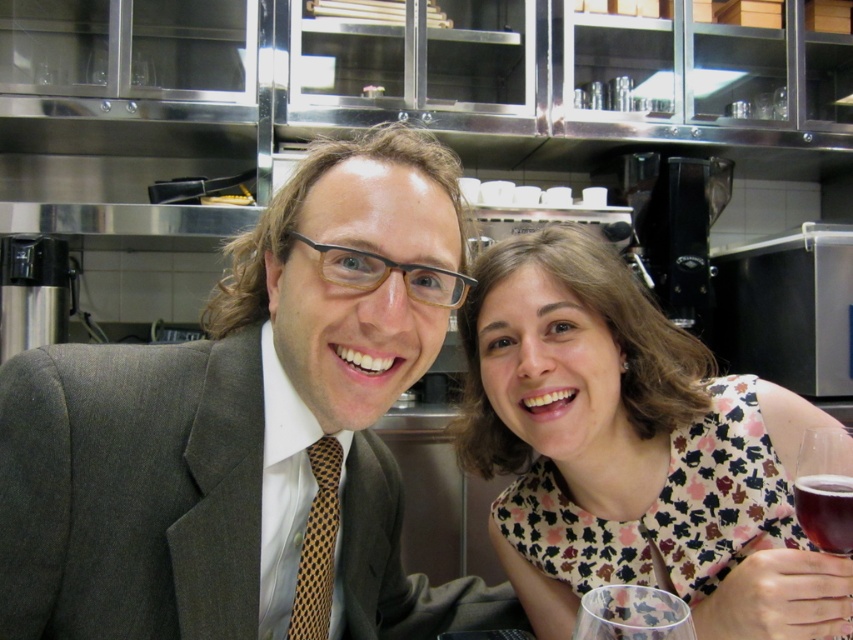
You are a photographer setting up for a group photo. You need to ensure that the matte gray suit at center and the transparent plastic wine glass at lower right are both in frame. Considering their sizes, which object will require more space in the photo to capture its full width?

The matte gray suit at center requires more space in the photo because its width is larger than the transparent plastic wine glass at lower right.